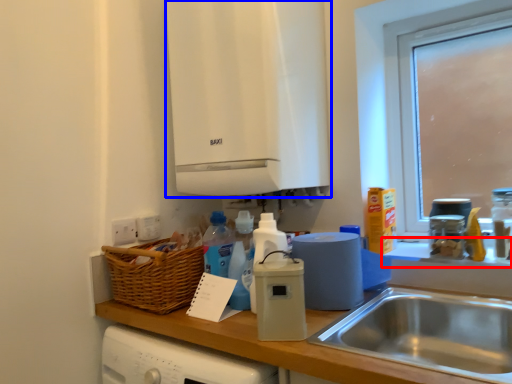
Question: Among these objects, which one is nearest to the camera, window sill (highlighted by a red box) or cabinetry (highlighted by a blue box)?

Choices:
 (A) window sill
 (B) cabinetry

Answer: (A)